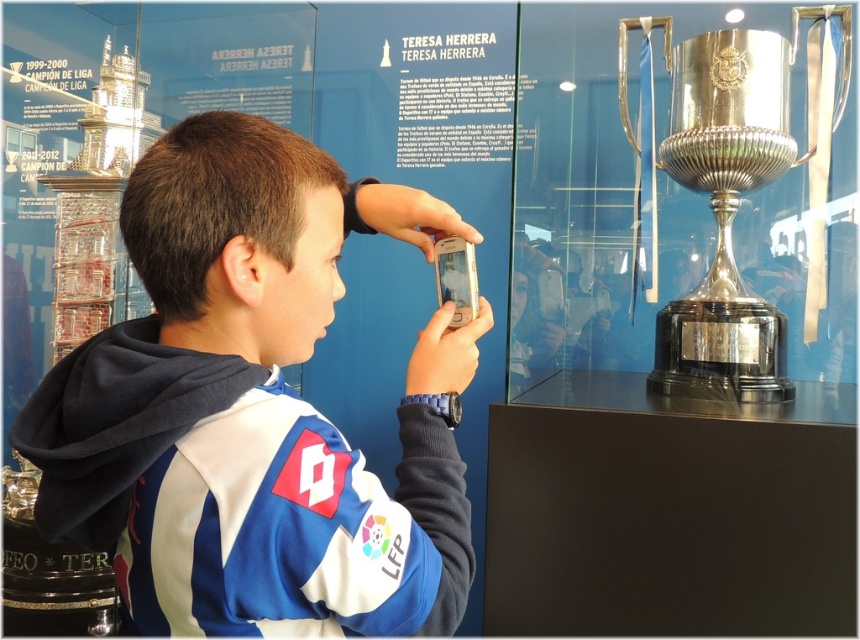
Does blue fabric jacket at center have a lesser width compared to polished silver trophy at right?

No, blue fabric jacket at center is not thinner than polished silver trophy at right.

Is point (301, 561) positioned behind point (670, 128)?

No, (301, 561) is closer to viewer.

This screenshot has width=860, height=640. What are the coordinates of `blue fabric jacket at center` in the screenshot? It's located at (255, 406).

Is blue fabric jacket at center wider than brown hair at upper center?

Yes.

Between blue fabric jacket at center and brown hair at upper center, which one is positioned lower?

Positioned lower is blue fabric jacket at center.

Does point (296, 422) come in front of point (266, 220)?

Yes, point (296, 422) is in front of point (266, 220).

Locate an element on the screen. This screenshot has height=640, width=860. blue fabric jacket at center is located at coordinates (255, 406).

Does brown hair at upper center have a larger size compared to polished silver trophy at right?

Incorrect, brown hair at upper center is not larger than polished silver trophy at right.

Which is behind, point (155, 237) or point (769, 49)?

Positioned behind is point (769, 49).

Find the location of a particular element. This screenshot has height=640, width=860. brown hair at upper center is located at coordinates (237, 236).

The height and width of the screenshot is (640, 860). I want to click on brown hair at upper center, so click(237, 236).